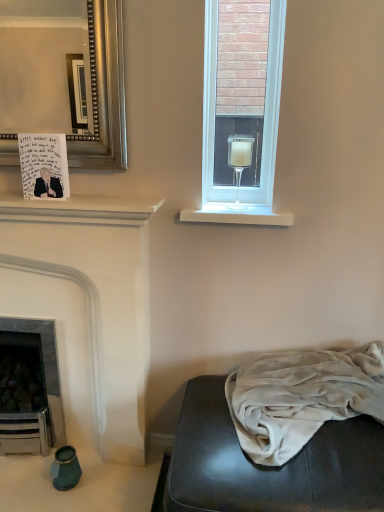
Question: Should I look upward or downward to see clear glass wine glass at upper right?

Choices:
 (A) up
 (B) down

Answer: (A)

Question: Considering the relative positions of white smooth window sill at upper right and velvet gray studio couch at lower right in the image provided, is white smooth window sill at upper right behind velvet gray studio couch at lower right?

Choices:
 (A) no
 (B) yes

Answer: (B)

Question: Can you confirm if white smooth window sill at upper right is smaller than velvet gray studio couch at lower right?

Choices:
 (A) yes
 (B) no

Answer: (A)

Question: Does white smooth window sill at upper right appear on the left side of velvet gray studio couch at lower right?

Choices:
 (A) yes
 (B) no

Answer: (A)

Question: Considering the relative sizes of white smooth window sill at upper right and velvet gray studio couch at lower right in the image provided, is white smooth window sill at upper right wider than velvet gray studio couch at lower right?

Choices:
 (A) no
 (B) yes

Answer: (A)

Question: Does white smooth window sill at upper right have a larger size compared to velvet gray studio couch at lower right?

Choices:
 (A) no
 (B) yes

Answer: (A)

Question: Does white smooth window sill at upper right have a greater height compared to velvet gray studio couch at lower right?

Choices:
 (A) no
 (B) yes

Answer: (A)

Question: Considering the relative sizes of white matte fireplace at left and velvet gray studio couch at lower right in the image provided, is white matte fireplace at left wider than velvet gray studio couch at lower right?

Choices:
 (A) yes
 (B) no

Answer: (B)

Question: Can you confirm if white matte fireplace at left is taller than velvet gray studio couch at lower right?

Choices:
 (A) no
 (B) yes

Answer: (B)

Question: Does white matte fireplace at left appear on the right side of velvet gray studio couch at lower right?

Choices:
 (A) no
 (B) yes

Answer: (A)

Question: Can you confirm if white matte fireplace at left is smaller than velvet gray studio couch at lower right?

Choices:
 (A) yes
 (B) no

Answer: (B)

Question: From the image's perspective, is white matte fireplace at left on top of velvet gray studio couch at lower right?

Choices:
 (A) no
 (B) yes

Answer: (B)

Question: Is white matte fireplace at left bigger than velvet gray studio couch at lower right?

Choices:
 (A) yes
 (B) no

Answer: (A)

Question: Is white matte fireplace at left at the left side of handwritten paper postcard at upper left?

Choices:
 (A) yes
 (B) no

Answer: (A)